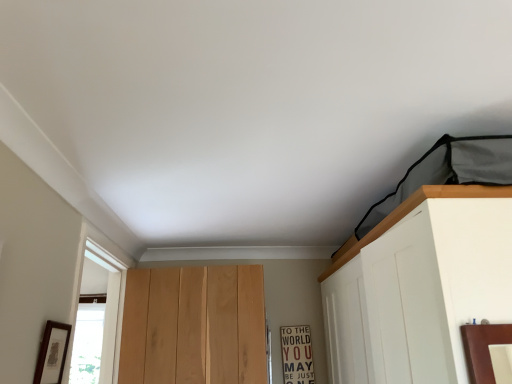
Question: Is matte black picture frame at lower left in front of or behind wooden sign at center in the image?

Choices:
 (A) front
 (B) behind

Answer: (A)

Question: In terms of size, does matte black picture frame at lower left appear bigger or smaller than wooden sign at center?

Choices:
 (A) big
 (B) small

Answer: (B)

Question: From a real-world perspective, is matte black picture frame at lower left above or below wooden sign at center?

Choices:
 (A) above
 (B) below

Answer: (A)

Question: Considering their positions, is wooden sign at center located in front of or behind matte black picture frame at lower left?

Choices:
 (A) front
 (B) behind

Answer: (B)

Question: From the image's perspective, is wooden sign at center located above or below matte black picture frame at lower left?

Choices:
 (A) below
 (B) above

Answer: (A)

Question: From a real-world perspective, is wooden sign at center positioned above or below matte black picture frame at lower left?

Choices:
 (A) above
 (B) below

Answer: (B)

Question: Based on their sizes in the image, would you say wooden sign at center is bigger or smaller than matte black picture frame at lower left?

Choices:
 (A) big
 (B) small

Answer: (A)